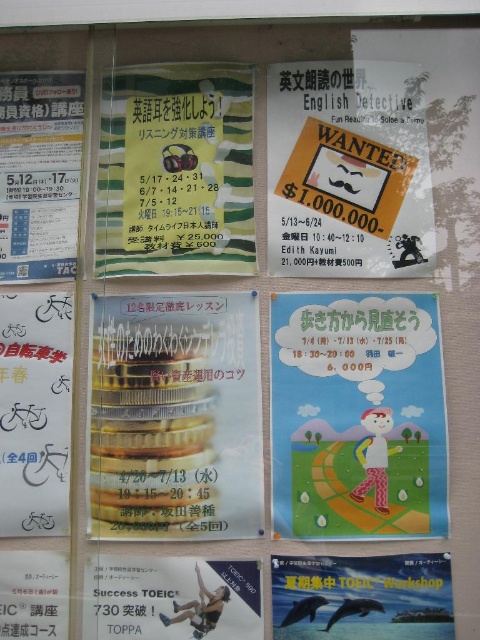
Does gold metallic coins at center have a lesser height compared to matte paper wanted poster at center?

No.

Can you confirm if gold metallic coins at center is smaller than matte paper wanted poster at center?

No, gold metallic coins at center is not smaller than matte paper wanted poster at center.

Describe the element at coordinates (175, 417) in the screenshot. The image size is (480, 640). I see `gold metallic coins at center` at that location.

Locate an element on the screen. This screenshot has width=480, height=640. gold metallic coins at center is located at coordinates (175, 417).

Is gold metallic coins at center in front of white paper poster at lower left?

No.

How much distance is there between gold metallic coins at center and white paper poster at lower left?

8.26 inches

This screenshot has height=640, width=480. What do you see at coordinates (175, 417) in the screenshot?
I see `gold metallic coins at center` at bounding box center [175, 417].

I want to click on gold metallic coins at center, so click(175, 417).

Which of these two, matte paper wanted poster at center or matte paper poster at left, stands shorter?

matte paper poster at left is shorter.

Does point (422, 252) come in front of point (21, 241)?

That is True.

Who is more distant from viewer, (423,241) or (71,204)?

Point (71,204)

Find the location of a particular element. Image resolution: width=480 pixels, height=640 pixels. matte paper wanted poster at center is located at coordinates (348, 170).